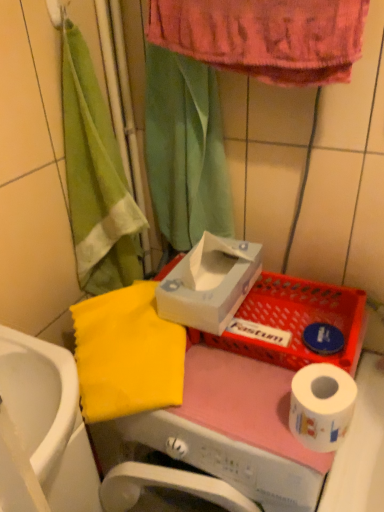
Identify the location of free spot to the left of white paper at lower right. (235, 413).